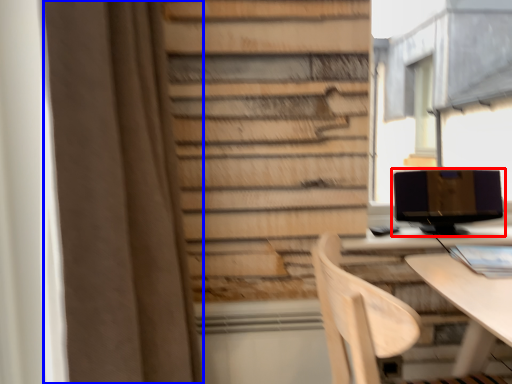
Question: Among these objects, which one is nearest to the camera, computer monitor (highlighted by a red box) or curtain (highlighted by a blue box)?

Choices:
 (A) computer monitor
 (B) curtain

Answer: (B)